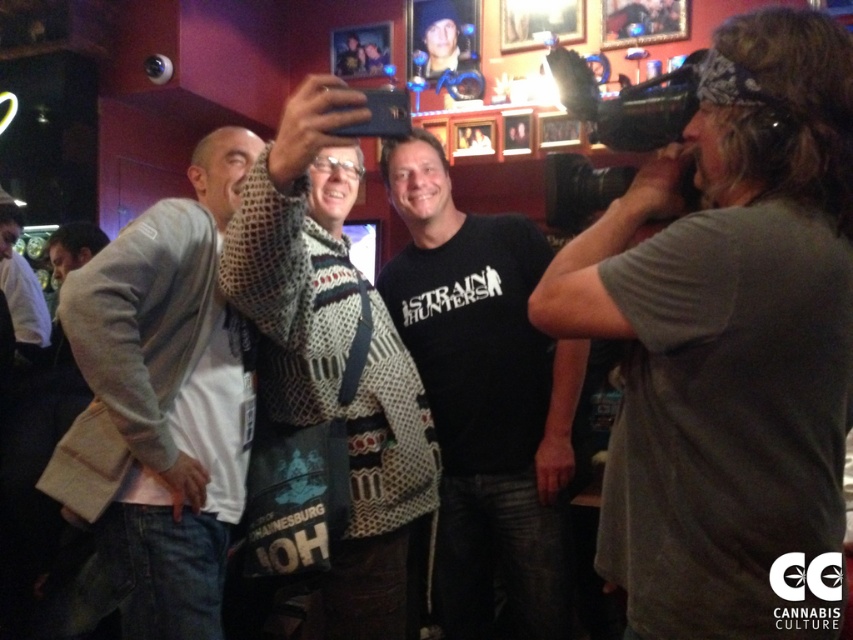
Is gray cotton t-shirt at right positioned in front of knitted sweater at center?

Yes, it is.

Which is above, gray cotton t-shirt at right or knitted sweater at center?

gray cotton t-shirt at right is above.

In order to click on gray cotton t-shirt at right in this screenshot , I will do `click(729, 344)`.

This screenshot has width=853, height=640. Find the location of `gray cotton t-shirt at right`. gray cotton t-shirt at right is located at coordinates (729, 344).

Can you confirm if gray cotton t-shirt at right is bigger than light gray sweater at left?

Incorrect, gray cotton t-shirt at right is not larger than light gray sweater at left.

Consider the image. Who is positioned more to the right, gray cotton t-shirt at right or light gray sweater at left?

gray cotton t-shirt at right

Who is more forward, (698, 209) or (212, 275)?

Point (698, 209)

Identify the location of gray cotton t-shirt at right. This screenshot has height=640, width=853. click(729, 344).

The height and width of the screenshot is (640, 853). Describe the element at coordinates (729, 344) in the screenshot. I see `gray cotton t-shirt at right` at that location.

Is gray cotton t-shirt at right positioned at the back of black cotton t-shirt at center?

No.

This screenshot has height=640, width=853. Describe the element at coordinates (729, 344) in the screenshot. I see `gray cotton t-shirt at right` at that location.

Locate an element on the screen. This screenshot has height=640, width=853. gray cotton t-shirt at right is located at coordinates click(729, 344).